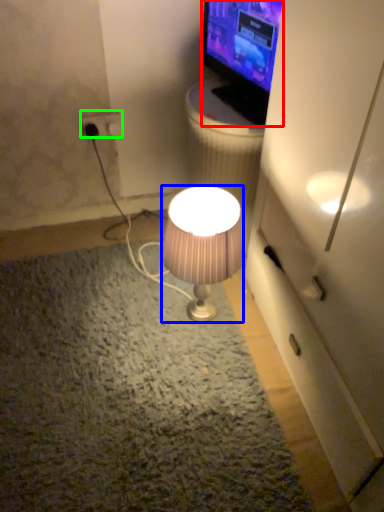
Question: Which is farther away from television (highlighted by a red box)? lamp (highlighted by a blue box) or power outlet (highlighted by a green box)?

Choices:
 (A) lamp
 (B) power outlet

Answer: (B)